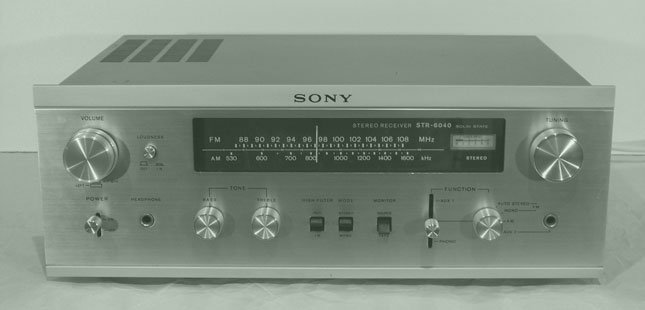
Locate an element on the screen. speaker is located at coordinates (204, 57).